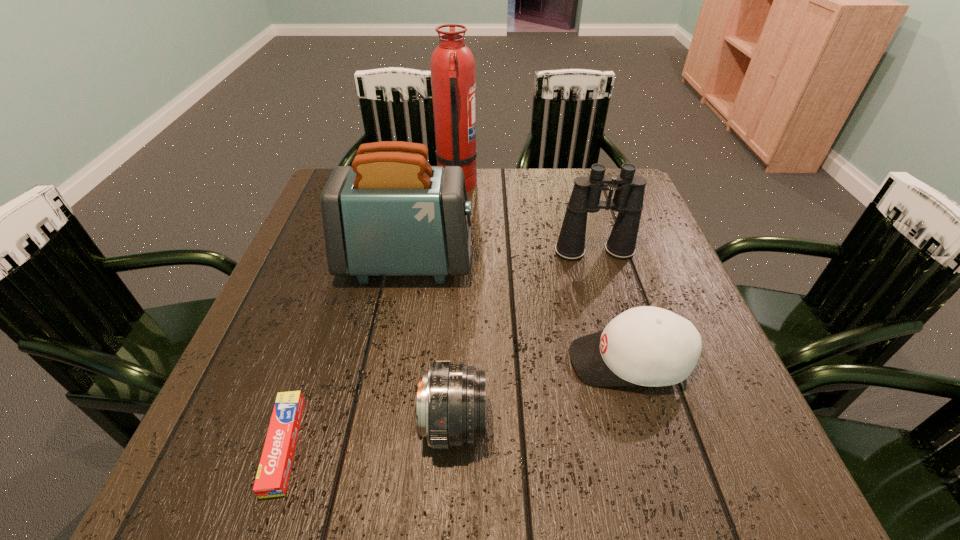
This screenshot has height=540, width=960. In order to click on vacant region located at the front element of the telephoto lens in this screenshot , I will do `click(582, 425)`.

This screenshot has height=540, width=960. In order to click on vacant space located 0.220m on the front-facing side of the baseball cap in this screenshot , I will do `click(452, 361)`.

This screenshot has width=960, height=540. In order to click on vacant region located 0.400m on the front-facing side of the baseball cap in this screenshot , I will do `click(356, 361)`.

Identify the location of vacant space located 0.260m on the front-facing side of the baseball cap. (431, 361).

Identify the location of vacant space located on the left of the shortest object. This screenshot has height=540, width=960. (236, 445).

Locate an element on the screen. The width and height of the screenshot is (960, 540). object at the far edge is located at coordinates (453, 75).

Locate an element on the screen. The height and width of the screenshot is (540, 960). telephoto lens located at the near edge is located at coordinates (450, 410).

Image resolution: width=960 pixels, height=540 pixels. What are the coordinates of `toothpaste that is at the near edge` in the screenshot? It's located at (273, 473).

Identify the location of toaster present at the left edge. The width and height of the screenshot is (960, 540). (391, 214).

Where is `toothpaste located in the left edge section of the desktop`? toothpaste located in the left edge section of the desktop is located at coordinates coord(273,473).